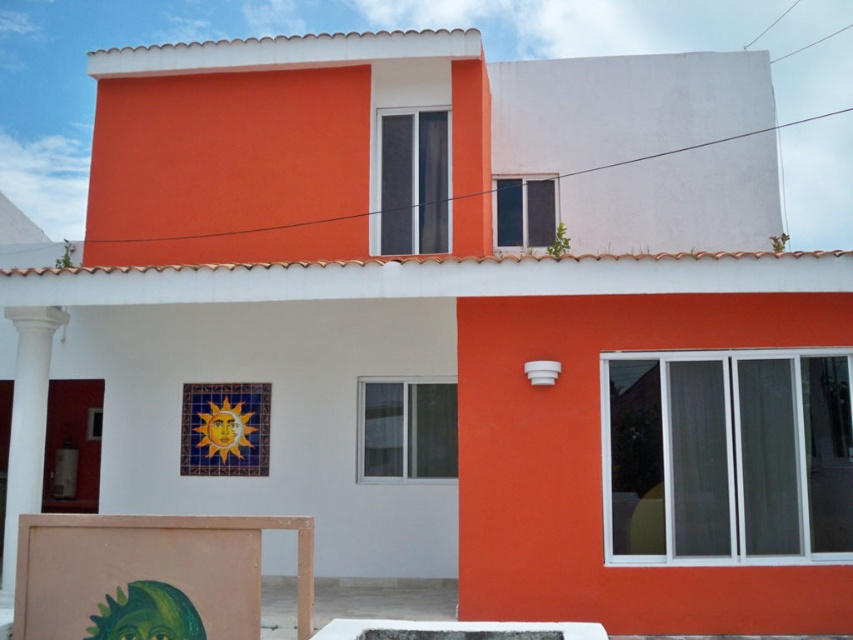
You are an artist setting up your equipment in front of the two story building. You have a matte pink easel at lower left and a white smooth column at left. Which object is smaller?

The matte pink easel at lower left is smaller than the white smooth column at left.

You are standing 5 meters away from the building. A point on the building is located at coordinates point (141,520). Is this point closer to you than the building itself?

The distance of point (141,520) from camera is 6.42 meters, which is farther than your current position of 5 meters away from the building. Therefore, the point is not closer to you than the building itself.

You are an artist standing in front of a two story building with a white lower section and orange upper section. You see a point at coordinate (149, 576). Where is this point located?

The point at coordinate (149, 576) is on the matte pink easel at lower left.